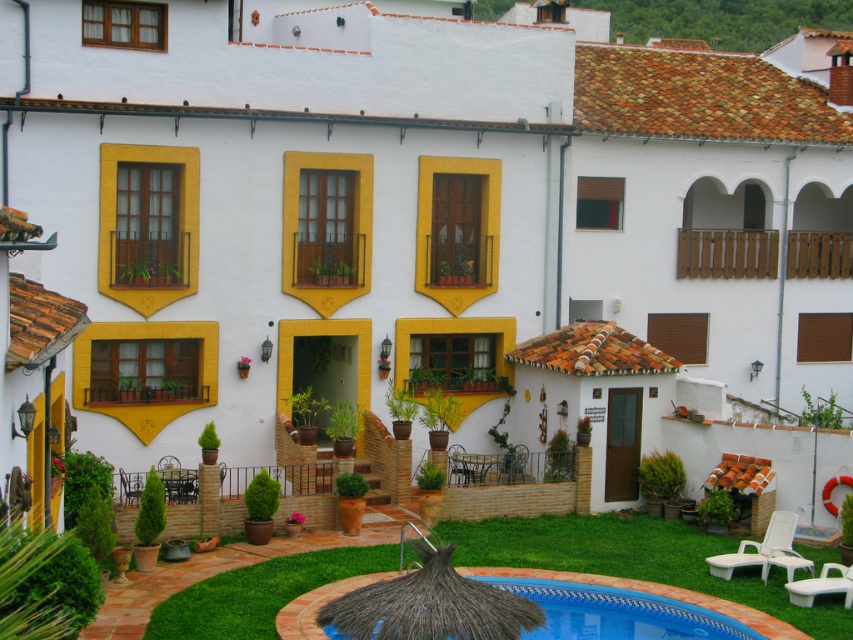
Question: Among these objects, which one is farthest from the camera?

Choices:
 (A) blue tile swimming pool at lower center
 (B) green grass at lower center

Answer: (A)

Question: Which point is farther to the camera?

Choices:
 (A) (618, 593)
 (B) (850, 612)

Answer: (A)

Question: Is green grass at lower center smaller than blue tile swimming pool at lower center?

Choices:
 (A) no
 (B) yes

Answer: (A)

Question: From the image, what is the correct spatial relationship of green grass at lower center in relation to blue tile swimming pool at lower center?

Choices:
 (A) below
 (B) above

Answer: (B)

Question: Which of the following is the closest to the observer?

Choices:
 (A) pyautogui.click(x=781, y=582)
 (B) pyautogui.click(x=738, y=611)

Answer: (B)

Question: Does green grass at lower center appear on the right side of blue tile swimming pool at lower center?

Choices:
 (A) no
 (B) yes

Answer: (A)